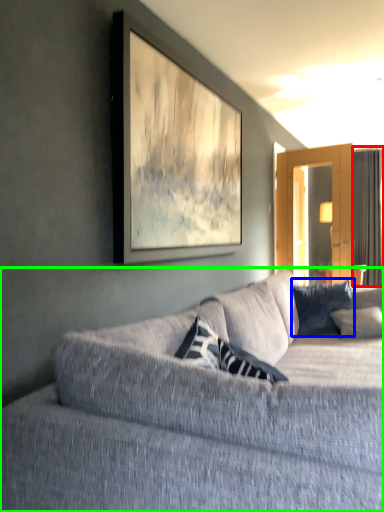
Question: Which is nearer to the curtain (highlighted by a red box)? pillow (highlighted by a blue box) or studio couch (highlighted by a green box).

Choices:
 (A) pillow
 (B) studio couch

Answer: (A)